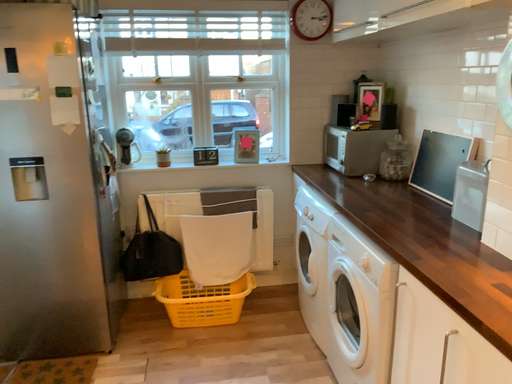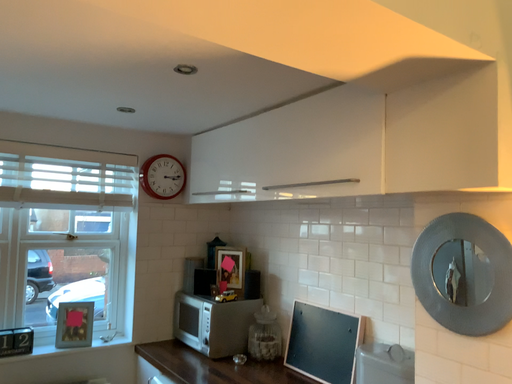
Question: Which way did the camera rotate in the video?

Choices:
 (A) rotated downward
 (B) rotated upward

Answer: (B)